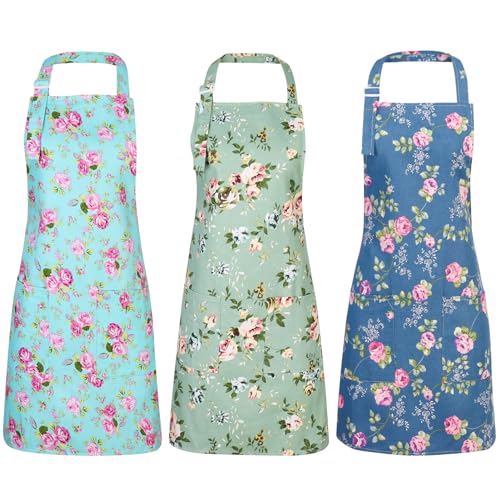
Identify the location of strap of apron that goes over the head. This screenshot has width=500, height=500. (102, 57), (259, 54), (409, 54).